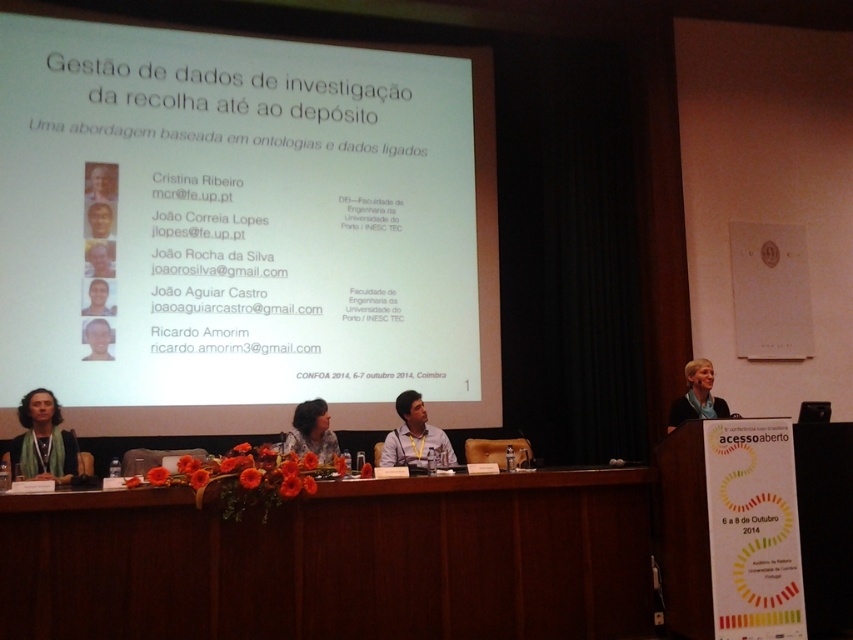
Question: Which object appears closest to the camera in this image?

Choices:
 (A) matte white shirt at lower right
 (B) matte black headshot at center

Answer: (A)

Question: Considering the real-world distances, which object is farthest from the matte black headshot at upper left?

Choices:
 (A) matte black headshot at center
 (B) matte yellow shirt at center
 (C) matte black hair at center
 (D) matte black laptop at upper left

Answer: (B)

Question: Is white paper at center positioned at the back of matte yellow shirt at center?

Choices:
 (A) no
 (B) yes

Answer: (B)

Question: Can you confirm if matte black headshot at upper left is positioned to the left of matte black laptop at center?

Choices:
 (A) yes
 (B) no

Answer: (A)

Question: Where is white paper at center located in relation to brown wood table at center in the image?

Choices:
 (A) right
 (B) left

Answer: (B)

Question: Among these objects, which one is nearest to the camera?

Choices:
 (A) matte white shirt at lower right
 (B) matte black headshot at upper left
 (C) light brown skin at center
 (D) green scarf at lower left

Answer: (D)